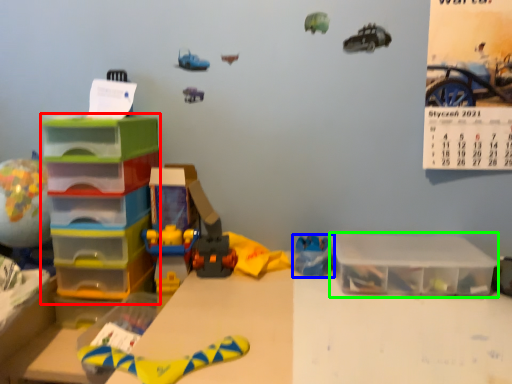
Question: Considering the real-world distances, which object is closest to shelf (highlighted by a red box)? toy (highlighted by a blue box) or storage box (highlighted by a green box).

Choices:
 (A) toy
 (B) storage box

Answer: (A)